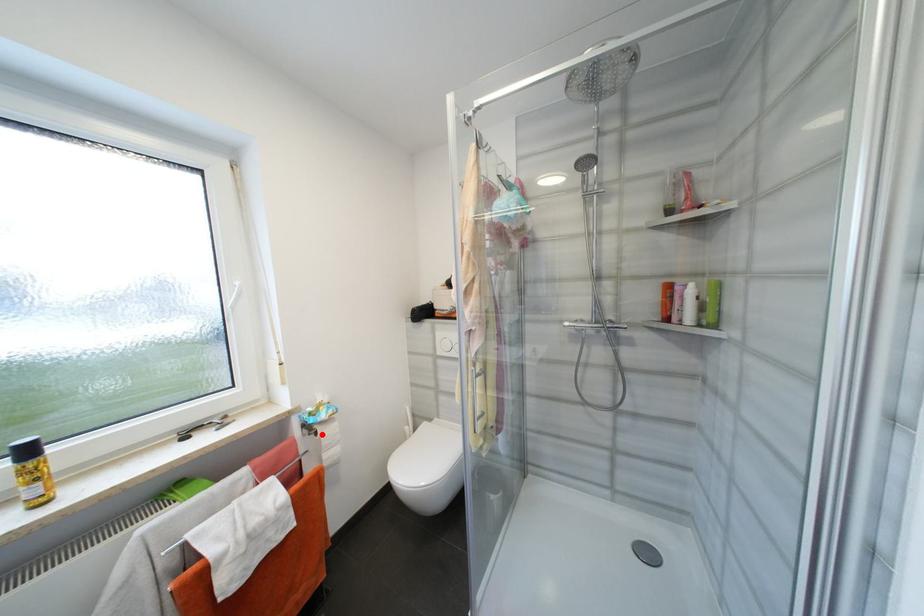
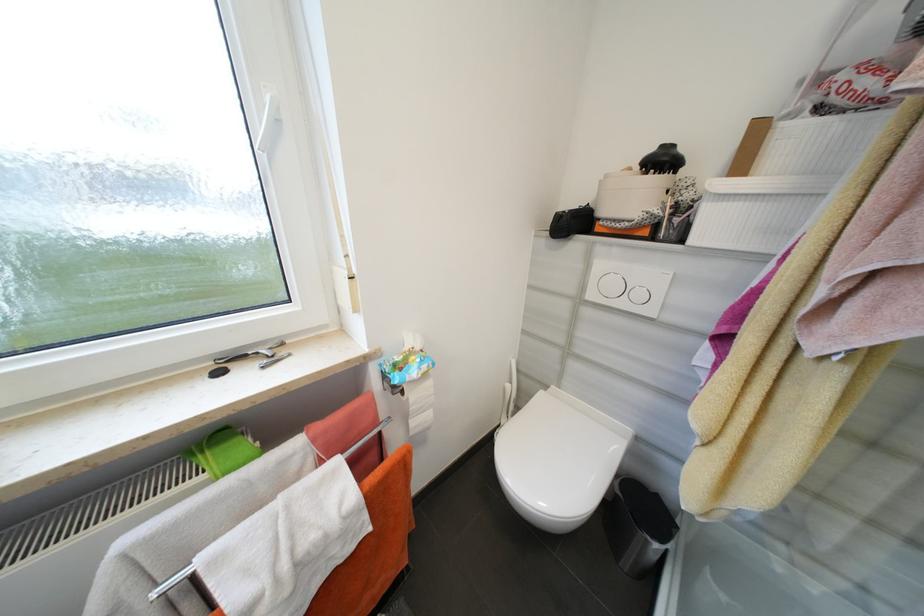
The point at the highlighted location is marked in the first image. Where is the corresponding point in the second image?

(407, 392)